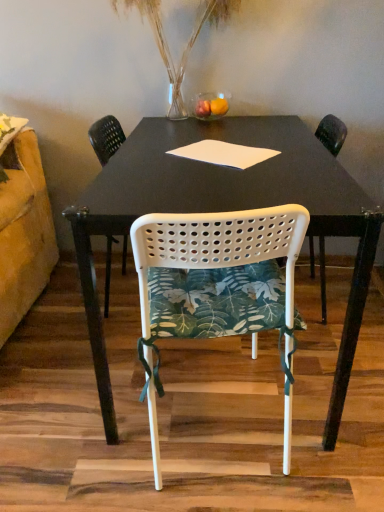
Question: Can you confirm if white perforated plastic chair at center, placed as the 1th chair when sorted from back to front, is positioned to the left of white matte table at center?

Choices:
 (A) no
 (B) yes

Answer: (B)

Question: From a real-world perspective, is white perforated plastic chair at center, placed as the 1th chair when sorted from back to front, under white matte table at center?

Choices:
 (A) no
 (B) yes

Answer: (B)

Question: Is white perforated plastic chair at center, the 2th chair positioned from the front, turned away from white matte table at center?

Choices:
 (A) yes
 (B) no

Answer: (B)

Question: From the image's perspective, is white perforated plastic chair at center, the 2th chair positioned from the front, located above white matte table at center?

Choices:
 (A) yes
 (B) no

Answer: (A)

Question: Is white perforated plastic chair at center, placed as the 1th chair when sorted from back to front, thinner than white matte table at center?

Choices:
 (A) no
 (B) yes

Answer: (B)

Question: Can you confirm if white paper at center is positioned to the left of white perforated plastic chair at center, the 1th chair from the front?

Choices:
 (A) yes
 (B) no

Answer: (B)

Question: Would you say white perforated plastic chair at center, the 1th chair from the front, is part of white paper at center's contents?

Choices:
 (A) yes
 (B) no

Answer: (B)

Question: Can you confirm if white paper at center is shorter than white perforated plastic chair at center, marked as the second chair in a back-to-front arrangement?

Choices:
 (A) yes
 (B) no

Answer: (A)

Question: Considering the relative sizes of white paper at center and white perforated plastic chair at center, the 1th chair from the front, in the image provided, is white paper at center wider than white perforated plastic chair at center, the 1th chair from the front,?

Choices:
 (A) no
 (B) yes

Answer: (A)

Question: Is white paper at center next to white perforated plastic chair at center, marked as the second chair in a back-to-front arrangement, and touching it?

Choices:
 (A) yes
 (B) no

Answer: (B)

Question: Does white paper at center appear on the right side of white perforated plastic chair at center, the 1th chair from the front?

Choices:
 (A) yes
 (B) no

Answer: (A)

Question: Is translucent glass vase at upper center smaller than white perforated plastic chair at center, marked as the second chair in a back-to-front arrangement?

Choices:
 (A) no
 (B) yes

Answer: (A)